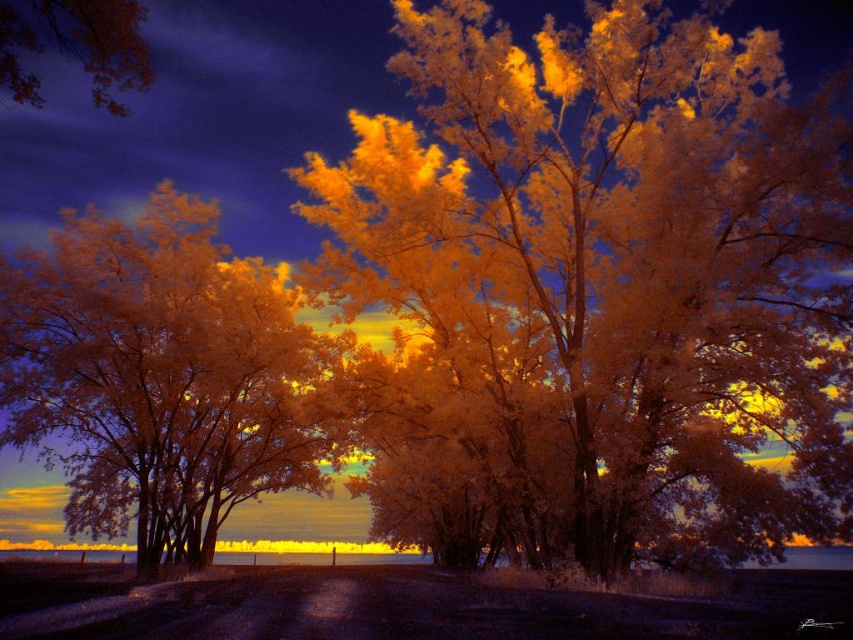
You are an artist analyzing this infrared photograph. You notice the golden textured tree at center and the orange leafy tree at upper left. Which tree would cast a longer shadow if the sun is positioned at the horizon? Please base your answer on their sizes as depicted in the image.

The golden textured tree at center is larger in size than the orange leafy tree at upper left, so it would cast a longer shadow.

You are an artist trying to paint the scene. You notice two trees at the center of the image. Which tree, the golden textured tree at center or the golden translucent tree at center, would require more space on your canvas to accurately depict its width?

The golden textured tree at center might be wider than golden translucent tree at center, so it would require more space on the canvas to accurately depict its width.

You are an artist analyzing this surreal landscape. You notice the golden textured tree at center and the orange leafy tree at upper left. Which tree appears wider in the image?

The golden textured tree at center appears wider than the orange leafy tree at upper left because its width surpasses the latter.